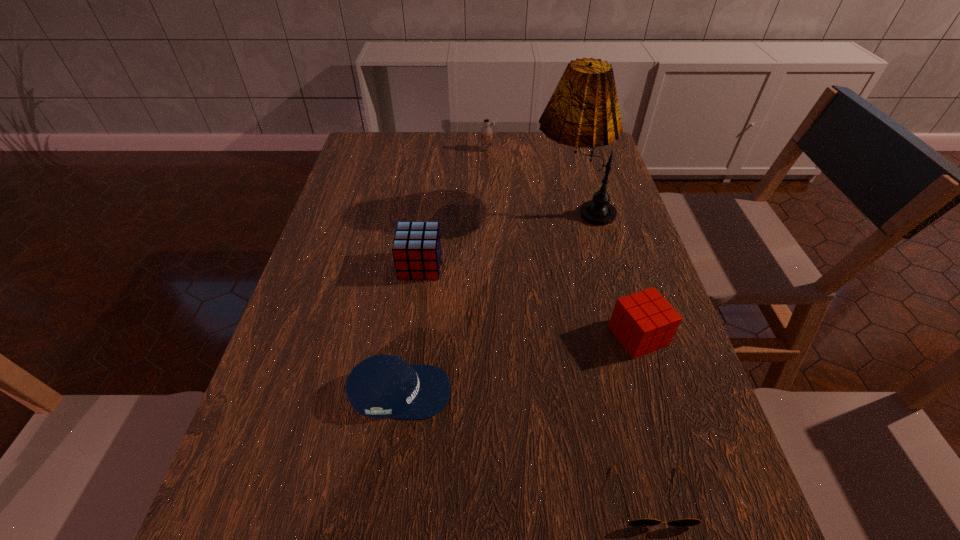
The width and height of the screenshot is (960, 540). Identify the location of the shortest object. (644, 522).

Locate an element on the screen. The image size is (960, 540). sunglasses is located at coordinates (644, 522).

Locate an element on the screen. The image size is (960, 540). vacant space situated on the front-facing side of the tallest object is located at coordinates (412, 210).

This screenshot has height=540, width=960. Identify the location of blank area located 0.060m on the front-facing side of the tallest object. (509, 210).

What are the coordinates of `vacant region located 0.180m on the front-facing side of the tallest object` in the screenshot? It's located at (468, 210).

Find the location of `free point located on the front of the farthest object`. free point located on the front of the farthest object is located at coordinates (488, 215).

Where is `vacant space located 0.080m on the left of the farther cube`? vacant space located 0.080m on the left of the farther cube is located at coordinates (368, 266).

The image size is (960, 540). What are the coordinates of `blank space located 0.220m on the back of the right cube` in the screenshot? It's located at (612, 249).

At what (x,y) coordinates should I click in order to perform the action: click on vacant space located 0.260m on the front-facing side of the baseball cap. Please return your answer as a coordinate pair (x, y). Looking at the image, I should click on 584,392.

What are the coordinates of `object that is at the far edge` in the screenshot? It's located at [x=486, y=132].